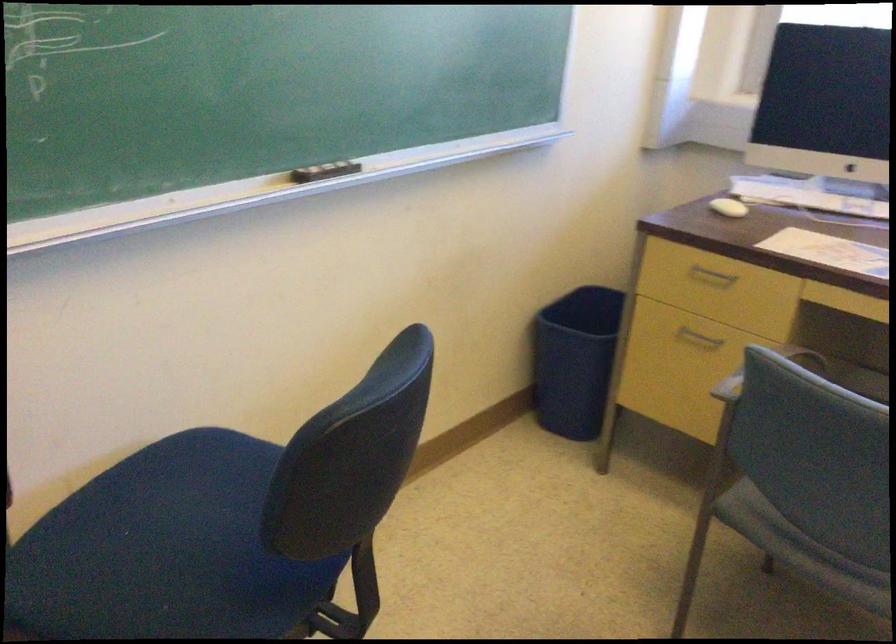
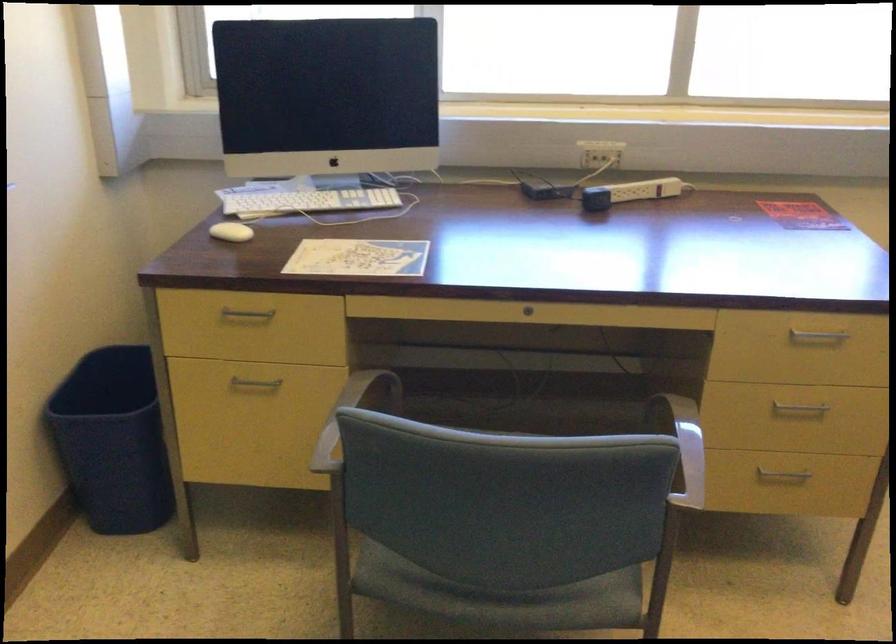
Locate, in the second image, the point that corresponds to the point at 730,202 in the first image.

(230, 232)